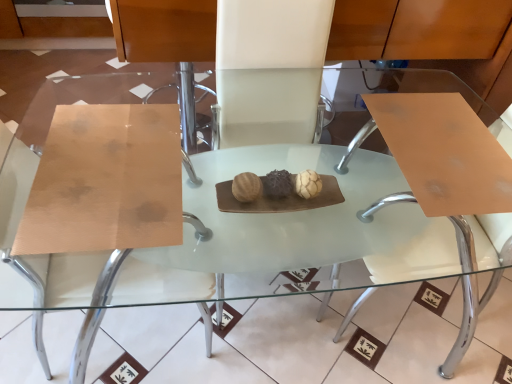
Looking at this image, how much space does matte wood chair at center, which appears as the 2th chair when viewed from the right, occupy horizontally?

20.34 inches.

The height and width of the screenshot is (384, 512). Identify the location of white leather chair at center, which is the 1th chair in right-to-left order. (270, 69).

From a real-world perspective, is white leather chair at center, placed as the second chair when sorted from left to right, located beneath matte wood chair at center, which appears as the 1th chair when viewed from the left?

No, from a real-world perspective, white leather chair at center, placed as the second chair when sorted from left to right, is not under matte wood chair at center, which appears as the 1th chair when viewed from the left.

At what (x,y) coordinates should I click in order to perform the action: click on chair in front of the white leather chair at center, which is the 1th chair in right-to-left order. Please return your answer as a coordinate pair (x, y). Image resolution: width=512 pixels, height=384 pixels. Looking at the image, I should click on (41, 255).

From the image's perspective, who appears lower, white leather chair at center, which is the 1th chair in right-to-left order, or matte wood chair at center, which appears as the 1th chair when viewed from the left?

From the image's view, matte wood chair at center, which appears as the 1th chair when viewed from the left, is below.

Would you say white leather chair at center, placed as the second chair when sorted from left to right, is inside or outside matte wood chair at center, which appears as the 2th chair when viewed from the right?

white leather chair at center, placed as the second chair when sorted from left to right, exists outside the volume of matte wood chair at center, which appears as the 2th chair when viewed from the right.

Visually, is matte brown swivel chair at right positioned to the left or to the right of matte wood chair at center, which appears as the 2th chair when viewed from the right?

From the image, it's evident that matte brown swivel chair at right is to the right of matte wood chair at center, which appears as the 2th chair when viewed from the right.

In terms of height, does matte brown swivel chair at right look taller or shorter compared to matte wood chair at center, which appears as the 1th chair when viewed from the left?

matte brown swivel chair at right is shorter than matte wood chair at center, which appears as the 1th chair when viewed from the left.

Do you think matte brown swivel chair at right is within matte wood chair at center, which appears as the 1th chair when viewed from the left, or outside of it?

matte brown swivel chair at right is located beyond the bounds of matte wood chair at center, which appears as the 1th chair when viewed from the left.

From the picture: From a real-world perspective, is matte brown swivel chair at right positioned under white leather chair at center, which is the 1th chair in right-to-left order, based on gravity?

Yes, from a real-world perspective, matte brown swivel chair at right is under white leather chair at center, which is the 1th chair in right-to-left order.

Which object is wider, matte brown swivel chair at right or white leather chair at center, placed as the second chair when sorted from left to right?

matte brown swivel chair at right.

Is point (463, 342) closer to camera compared to point (291, 73)?

No, (463, 342) is behind (291, 73).

Is there a large distance between matte brown swivel chair at right and white leather chair at center, placed as the second chair when sorted from left to right?

They are positioned close to each other.

Considering the relative sizes of white leather chair at center, placed as the second chair when sorted from left to right, and matte brown swivel chair at right in the image provided, is white leather chair at center, placed as the second chair when sorted from left to right, shorter than matte brown swivel chair at right?

No.

Considering their positions, is white leather chair at center, placed as the second chair when sorted from left to right, located in front of or behind matte brown swivel chair at right?

In the image, white leather chair at center, placed as the second chair when sorted from left to right, appears behind matte brown swivel chair at right.

Find the location of `swivel chair below the white leather chair at center, which is the 1th chair in right-to-left order (from a real-world perspective)`. swivel chair below the white leather chair at center, which is the 1th chair in right-to-left order (from a real-world perspective) is located at coordinates (443, 179).

Does matte wood chair at center, which appears as the 2th chair when viewed from the right, appear on the right side of matte brown swivel chair at right?

No, matte wood chair at center, which appears as the 2th chair when viewed from the right, is not to the right of matte brown swivel chair at right.

Is matte wood chair at center, which appears as the 2th chair when viewed from the right, facing towards matte brown swivel chair at right?

Yes, matte wood chair at center, which appears as the 2th chair when viewed from the right, faces towards matte brown swivel chair at right.

Which object is wider, matte wood chair at center, which appears as the 1th chair when viewed from the left, or matte brown swivel chair at right?

With larger width is matte wood chair at center, which appears as the 1th chair when viewed from the left.

Is matte wood chair at center, which appears as the 2th chair when viewed from the right, with white leather chair at center, placed as the second chair when sorted from left to right?

No, matte wood chair at center, which appears as the 2th chair when viewed from the right, is not beside white leather chair at center, placed as the second chair when sorted from left to right.

How different are the orientations of matte wood chair at center, which appears as the 1th chair when viewed from the left, and white leather chair at center, placed as the second chair when sorted from left to right, in degrees?

93.3 degrees.

Between matte wood chair at center, which appears as the 1th chair when viewed from the left, and white leather chair at center, placed as the second chair when sorted from left to right, which one has smaller width?

white leather chair at center, placed as the second chair when sorted from left to right.

Is point (199, 306) closer to viewer compared to point (241, 73)?

No.

The width and height of the screenshot is (512, 384). What are the coordinates of `chair that appears behind the matte wood chair at center, which appears as the 1th chair when viewed from the left` in the screenshot? It's located at (270, 69).

At what (x,y) coordinates should I click in order to perform the action: click on swivel chair to the right of matte wood chair at center, which appears as the 1th chair when viewed from the left. Please return your answer as a coordinate pair (x, y). The height and width of the screenshot is (384, 512). Looking at the image, I should click on click(x=443, y=179).

From the image, which object appears to be nearer to white leather chair at center, placed as the second chair when sorted from left to right, matte wood chair at center, which appears as the 2th chair when viewed from the right, or matte brown swivel chair at right?

Based on the image, matte brown swivel chair at right appears to be nearer to white leather chair at center, placed as the second chair when sorted from left to right.

Which object lies further to the anchor point white leather chair at center, which is the 1th chair in right-to-left order, matte brown swivel chair at right or matte wood chair at center, which appears as the 2th chair when viewed from the right?

matte wood chair at center, which appears as the 2th chair when viewed from the right, lies further to white leather chair at center, which is the 1th chair in right-to-left order, than the other object.

Looking at the image, which one is located closer to matte brown swivel chair at right, white leather chair at center, which is the 1th chair in right-to-left order, or matte wood chair at center, which appears as the 2th chair when viewed from the right?

The object closer to matte brown swivel chair at right is white leather chair at center, which is the 1th chair in right-to-left order.

Looking at the image, which one is located further to matte wood chair at center, which appears as the 2th chair when viewed from the right, matte brown swivel chair at right or white leather chair at center, which is the 1th chair in right-to-left order?

Based on the image, matte brown swivel chair at right appears to be further to matte wood chair at center, which appears as the 2th chair when viewed from the right.

Based on their spatial positions, is matte wood chair at center, which appears as the 2th chair when viewed from the right, or white leather chair at center, which is the 1th chair in right-to-left order, further from matte brown swivel chair at right?

matte wood chair at center, which appears as the 2th chair when viewed from the right.

When comparing their distances from matte wood chair at center, which appears as the 1th chair when viewed from the left, does white leather chair at center, placed as the second chair when sorted from left to right, or matte brown swivel chair at right seem closer?

The object closer to matte wood chair at center, which appears as the 1th chair when viewed from the left, is white leather chair at center, placed as the second chair when sorted from left to right.

Identify the location of chair between matte wood chair at center, which appears as the 1th chair when viewed from the left, and matte brown swivel chair at right. The height and width of the screenshot is (384, 512). (270, 69).